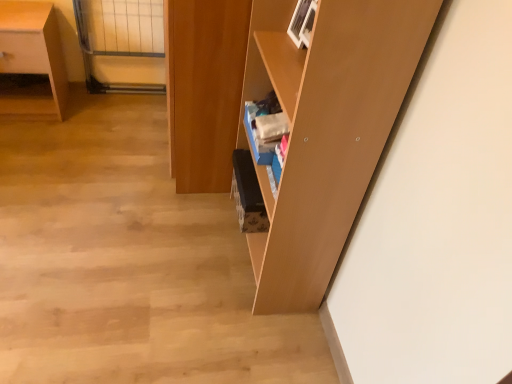
Where is `free space to the left of wooden cabinet at center`? The image size is (512, 384). free space to the left of wooden cabinet at center is located at coordinates (96, 143).